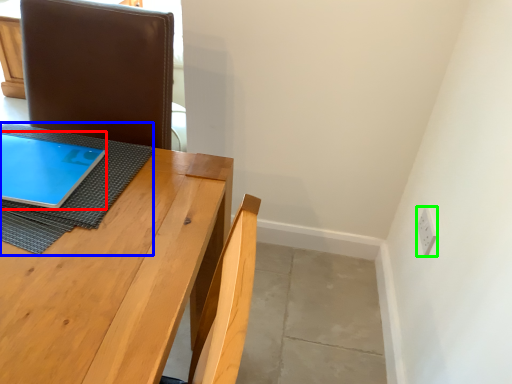
Question: Based on their relative distances, which object is nearer to tablet computer (highlighted by a red box)? Choose from cloth (highlighted by a blue box) and electric outlet (highlighted by a green box).

Choices:
 (A) cloth
 (B) electric outlet

Answer: (A)